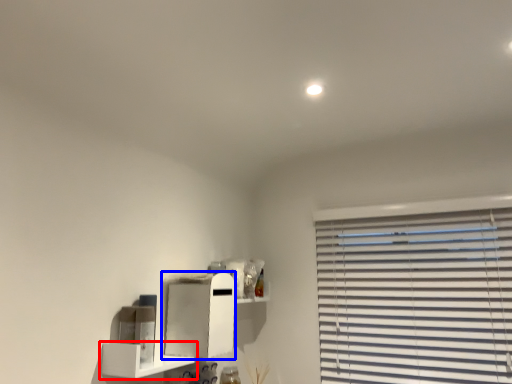
Question: Among these objects, which one is nearest to the camera, shelf (highlighted by a red box) or cabinet (highlighted by a blue box)?

Choices:
 (A) shelf
 (B) cabinet

Answer: (A)